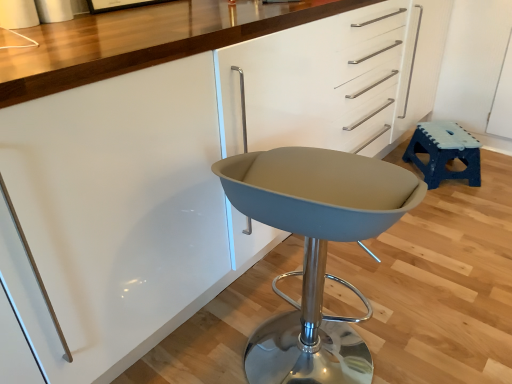
You are a GUI agent. You are given a task and a screenshot of the screen. Output one action in this format:
    pyautogui.click(x=<x>, y=<y>)
    Task: Click on the vacant area that lies to the right of matte gray swivel chair at center
    The image size is (512, 384).
    Given the screenshot: What is the action you would take?
    pyautogui.click(x=428, y=329)